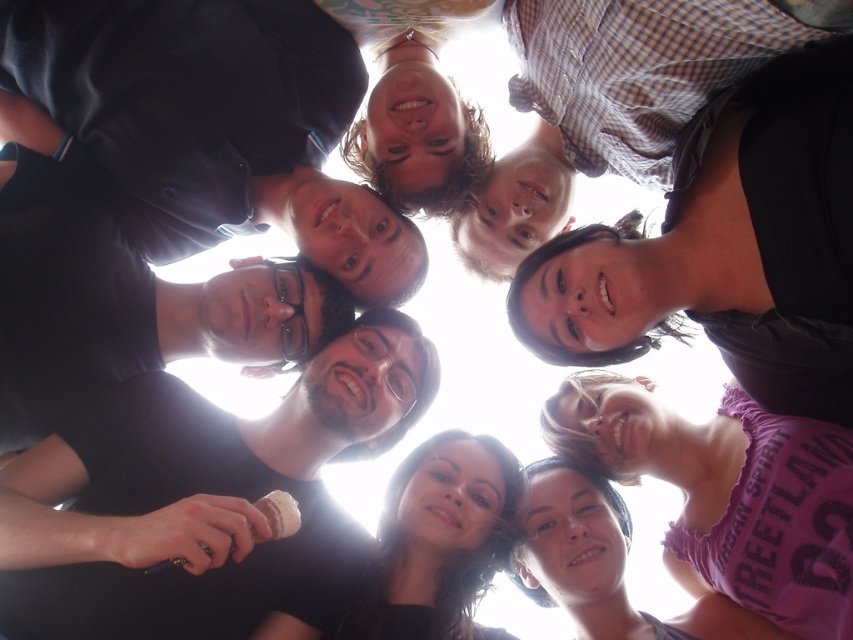
You are a photographer standing at the bottom of the group. You want to capture a closeup shot of the black matte ice cream cone at center and the checkered shirt at upper center. Can you fit both objects in the frame without moving your camera?

The black matte ice cream cone at center and checkered shirt at upper center are 24.96 inches apart. Since the distance between them is less than the camera frame width, you can fit both in the frame without moving the camera.

You are a photographer who wants to capture a closeup shot of the text on the black matte shirt at upper left and the checkered shirt at upper center. Your camera has a maximum focus range of 50 centimeters. Can you focus on both shirts at the same time?

The black matte shirt at upper left and checkered shirt at upper center are 49.44 centimeters apart, so yes, the camera can focus on both shirts simultaneously since the distance between them is within the 50 centimeter range.